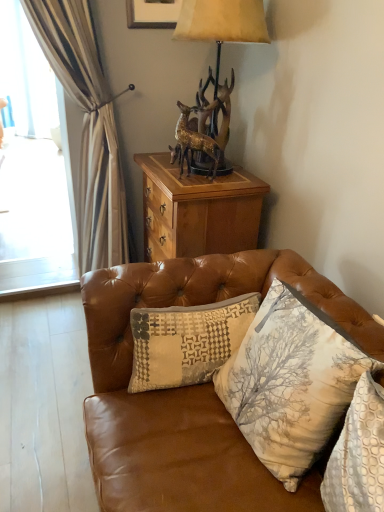
Question: Considering the relative positions of textured beige pillow at center, which is the 3th pillow from right to left, and matte gray picture frame at upper center in the image provided, is textured beige pillow at center, which is the 3th pillow from right to left, behind matte gray picture frame at upper center?

Choices:
 (A) yes
 (B) no

Answer: (B)

Question: Is textured beige pillow at center, which is the 3th pillow from right to left, smaller than matte gray picture frame at upper center?

Choices:
 (A) yes
 (B) no

Answer: (B)

Question: Considering the relative positions of textured beige pillow at center, which ranks as the 1th pillow in left-to-right order, and matte gray picture frame at upper center in the image provided, is textured beige pillow at center, which ranks as the 1th pillow in left-to-right order, in front of matte gray picture frame at upper center?

Choices:
 (A) no
 (B) yes

Answer: (B)

Question: From the image's perspective, is textured beige pillow at center, which is the 3th pillow from right to left, located beneath matte gray picture frame at upper center?

Choices:
 (A) no
 (B) yes

Answer: (B)

Question: Does textured beige pillow at center, which is the 3th pillow from right to left, have a greater width compared to matte gray picture frame at upper center?

Choices:
 (A) yes
 (B) no

Answer: (A)

Question: In terms of size, does gold metallic deer at center appear bigger or smaller than beige textured pillow at center, placed as the 2th pillow when sorted from left to right?

Choices:
 (A) small
 (B) big

Answer: (A)

Question: Would you say gold metallic deer at center is to the left or to the right of beige textured pillow at center, placed as the 2th pillow when sorted from left to right, in the picture?

Choices:
 (A) right
 (B) left

Answer: (B)

Question: From their relative heights in the image, would you say gold metallic deer at center is taller or shorter than beige textured pillow at center, the second pillow in the right-to-left sequence?

Choices:
 (A) short
 (B) tall

Answer: (A)

Question: Is gold metallic deer at center inside or outside of beige textured pillow at center, the second pillow in the right-to-left sequence?

Choices:
 (A) inside
 (B) outside

Answer: (B)

Question: Is point (259, 197) closer or farther from the camera than point (158, 311)?

Choices:
 (A) farther
 (B) closer

Answer: (A)

Question: Visually, is wooden cabinet at upper center positioned to the left or to the right of textured beige pillow at center, which ranks as the 1th pillow in left-to-right order?

Choices:
 (A) left
 (B) right

Answer: (B)

Question: Is wooden cabinet at upper center bigger or smaller than textured beige pillow at center, which is the 3th pillow from right to left?

Choices:
 (A) big
 (B) small

Answer: (A)

Question: Is wooden cabinet at upper center in front of or behind textured beige pillow at center, which ranks as the 1th pillow in left-to-right order, in the image?

Choices:
 (A) front
 (B) behind

Answer: (B)

Question: Is point (185, 323) positioned closer to the camera than point (147, 204)?

Choices:
 (A) closer
 (B) farther

Answer: (A)

Question: Looking at their shapes, would you say textured beige pillow at center, which ranks as the 1th pillow in left-to-right order, is wider or thinner than wooden cabinet at upper center?

Choices:
 (A) wide
 (B) thin

Answer: (B)